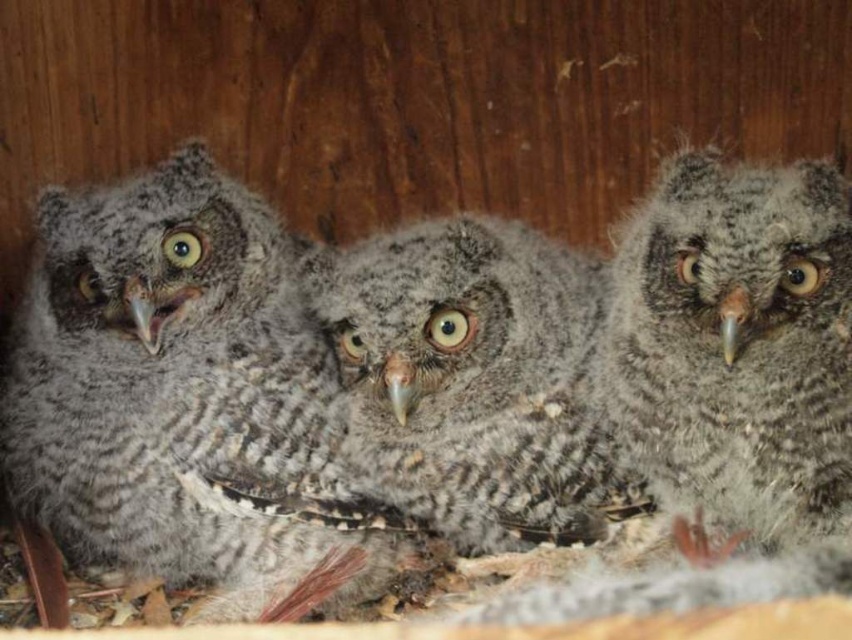
You are an owl parent looking for your babies in a wooden nest box. You see three baby owls. One of them is at point (182, 396). Which baby owl is at that exact coordinate?

The gray fluffy owl at left is located at point (182, 396).

You are a wildlife photographer aiming to capture a closeup of the gray fluffy owl at right. Based on its position coordinates, can you determine if it is positioned towards the right side of the image?

The gray fluffy owl at right is located at point 0.539 on the x axis and 0.866 on the y axis. Since the x coordinate is less than 0.5, it is positioned towards the left side of the image.